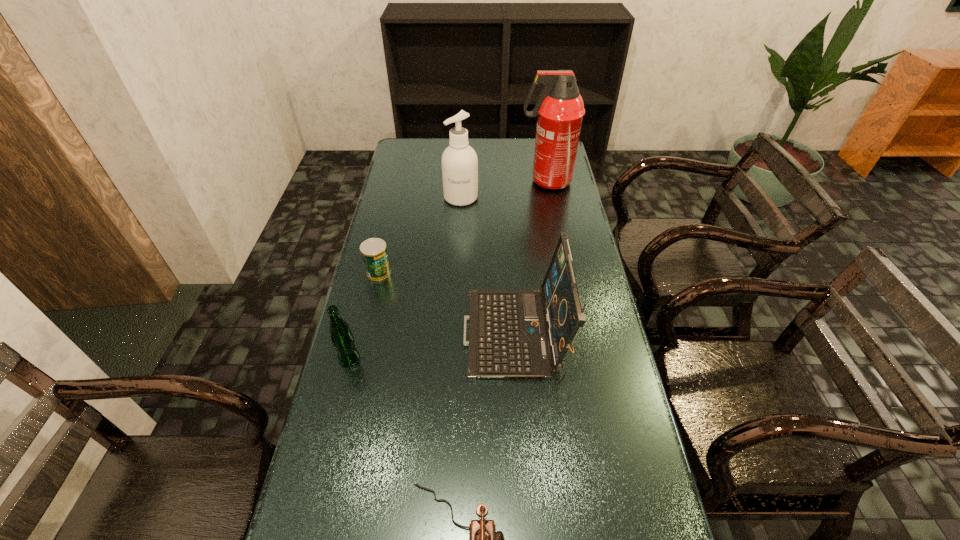
This screenshot has width=960, height=540. In order to click on vacant region at the left edge of the desktop in this screenshot , I will do `click(401, 228)`.

Locate an element on the screen. free location at the right edge of the desktop is located at coordinates (642, 528).

In order to click on free space between the laptop computer and the beer bottle in this screenshot , I will do `click(432, 348)`.

Locate an element on the screen. The image size is (960, 540). empty location between the can and the cleansing agent is located at coordinates click(x=420, y=235).

Image resolution: width=960 pixels, height=540 pixels. What are the coordinates of `vacant area that lies between the cleansing agent and the tallest object` in the screenshot? It's located at (503, 190).

Where is `vacant area between the fifth shortest object and the third tallest object`? Image resolution: width=960 pixels, height=540 pixels. vacant area between the fifth shortest object and the third tallest object is located at coordinates (488, 267).

Where is `empty space between the third tallest object and the fire extinguisher`? This screenshot has width=960, height=540. empty space between the third tallest object and the fire extinguisher is located at coordinates (531, 259).

The image size is (960, 540). I want to click on vacant area that lies between the second shortest object and the fourth shortest object, so click(x=446, y=305).

This screenshot has height=540, width=960. Find the location of `object that stands as the fifth closest to the third farthest object`. object that stands as the fifth closest to the third farthest object is located at coordinates (483, 539).

The height and width of the screenshot is (540, 960). In order to click on object that stands as the closest to the tallest object in this screenshot , I will do `click(459, 161)`.